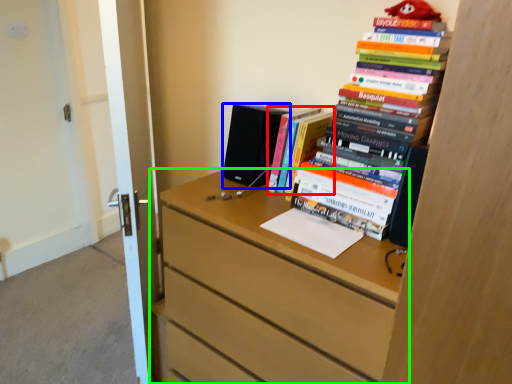
Question: Estimate the real-world distances between objects in this image. Which object is closer to book (highlighted by a red box), speaker (highlighted by a blue box) or chest of drawers (highlighted by a green box)?

Choices:
 (A) speaker
 (B) chest of drawers

Answer: (A)